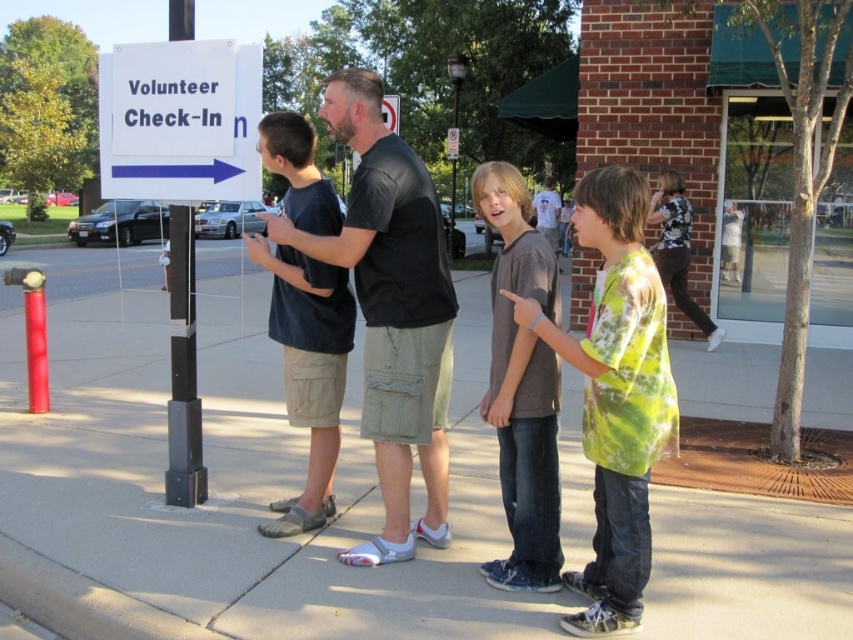
Question: Can you confirm if gray concrete sidewalk at center is thinner than white plastic sign at upper left?

Choices:
 (A) no
 (B) yes

Answer: (A)

Question: Does black leather shirt at center have a smaller size compared to gray cotton shirt at center?

Choices:
 (A) yes
 (B) no

Answer: (B)

Question: Which point appears farthest from the camera in this image?

Choices:
 (A) (517, 429)
 (B) (109, 64)

Answer: (B)

Question: Is green tie-dye shirt at center to the left of white plastic sign at upper left from the viewer's perspective?

Choices:
 (A) no
 (B) yes

Answer: (A)

Question: Estimate the real-world distances between objects in this image. Which object is farther from the green tie-dye shirt at center?

Choices:
 (A) gray concrete sidewalk at center
 (B) dark gray cotton t-shirt at center
 (C) white plastic sign at upper left

Answer: (A)

Question: Which point is farther to the camera?

Choices:
 (A) gray concrete sidewalk at center
 (B) black metal pole at left
 (C) green tie-dye shirt at center
 (D) gray cotton shirt at center

Answer: (B)